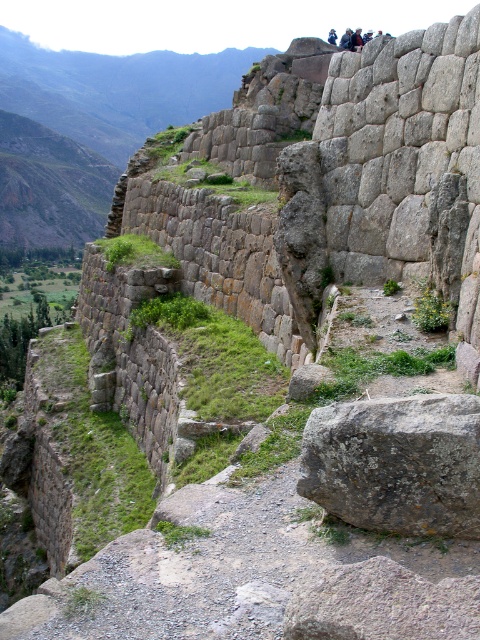
Is dark brown leather jacket at upper center positioned behind dark blue fabric at upper center?

No.

Does point (359, 49) come behind point (349, 45)?

Yes.

What do you see at coordinates (356, 40) in the screenshot?
I see `dark brown leather jacket at upper center` at bounding box center [356, 40].

I want to click on dark brown leather jacket at upper center, so click(356, 40).

Is gray rough rock at center wider than dark hair person at upper center?

In fact, gray rough rock at center might be narrower than dark hair person at upper center.

Does point (376, 502) come behind point (336, 44)?

No.

Where is `gray rough rock at center`? This screenshot has width=480, height=640. gray rough rock at center is located at coordinates (396, 464).

The image size is (480, 640). I want to click on gray rough rock at center, so click(396, 464).

Which of these two, gray rough rock at center or dark brown leather jacket at upper center, stands shorter?

With less height is gray rough rock at center.

Does gray rough rock at center have a lesser width compared to dark brown leather jacket at upper center?

Indeed, gray rough rock at center has a lesser width compared to dark brown leather jacket at upper center.

Describe the element at coordinates (396, 464) in the screenshot. The height and width of the screenshot is (640, 480). I see `gray rough rock at center` at that location.

Where is `gray rough rock at center`? gray rough rock at center is located at coordinates (396, 464).